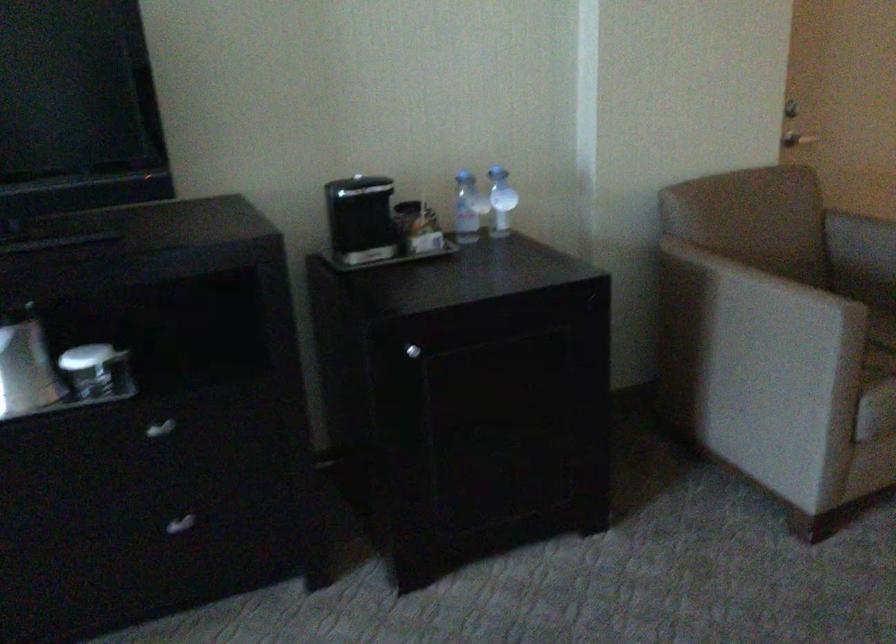
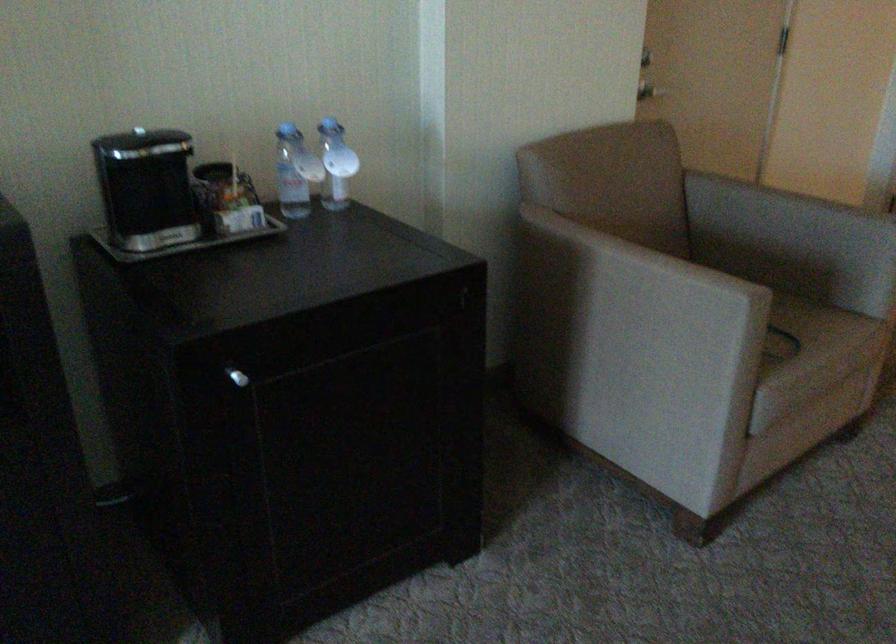
In the second image, find the point that corresponds to point 748,303 in the first image.

(631, 283)